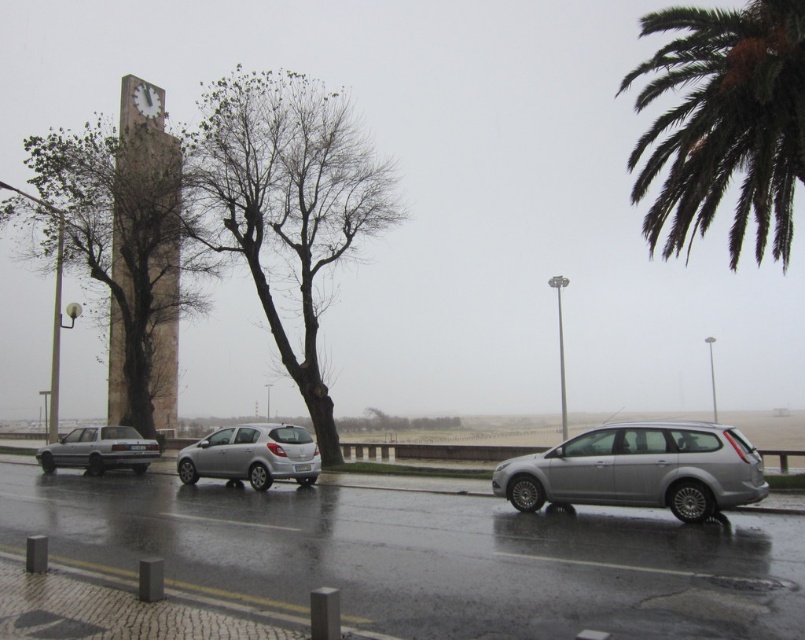
Can you confirm if silver metallic station wagon at center-right is wider than satin silver hatchback at center?

In fact, silver metallic station wagon at center-right might be narrower than satin silver hatchback at center.

Is silver metallic station wagon at center-right shorter than satin silver hatchback at center?

Yes.

Does point (704, 458) lie behind point (262, 444)?

That is False.

Find the location of a particular element. silver metallic station wagon at center-right is located at coordinates (638, 468).

Which is more to the left, satin silver hatchback at center or silver metallic sedan at center?

From the viewer's perspective, silver metallic sedan at center appears more on the left side.

What do you see at coordinates (252, 456) in the screenshot?
I see `satin silver hatchback at center` at bounding box center [252, 456].

The height and width of the screenshot is (640, 805). I want to click on satin silver hatchback at center, so click(x=252, y=456).

Does bare wood tree at center appear on the left side of silver metallic station wagon at center-right?

Yes, bare wood tree at center is to the left of silver metallic station wagon at center-right.

Is bare wood tree at center above silver metallic station wagon at center-right?

Indeed, bare wood tree at center is positioned over silver metallic station wagon at center-right.

Between point (329, 148) and point (632, 452), which one is positioned behind?

Point (329, 148)

Locate an element on the screen. The height and width of the screenshot is (640, 805). bare wood tree at center is located at coordinates (285, 202).